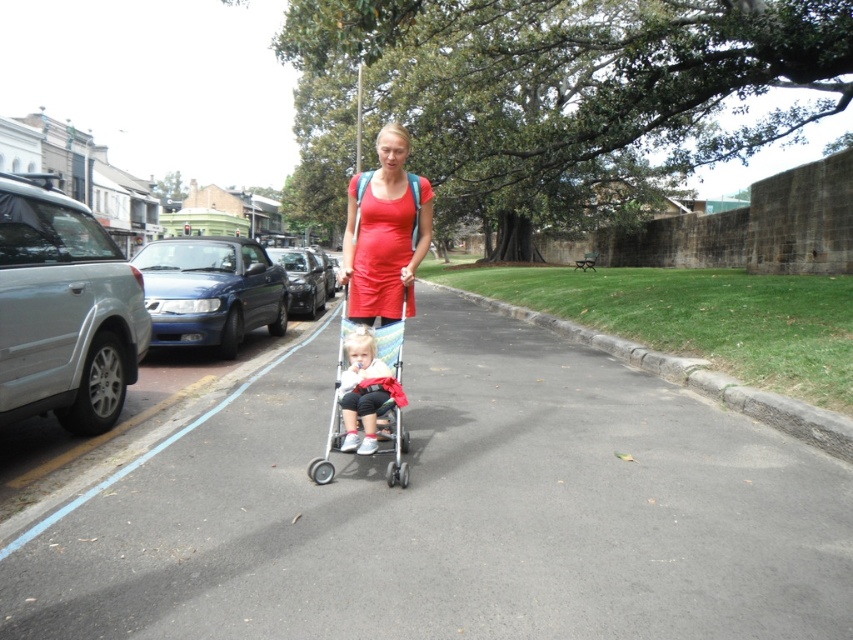
Which of these two, blue metallic car at left or shiny black car at center-left, stands taller?

With more height is shiny black car at center-left.

Is blue metallic car at left above shiny black car at center-left?

No.

Image resolution: width=853 pixels, height=640 pixels. What are the coordinates of `blue metallic car at left` in the screenshot? It's located at [x=212, y=291].

Which is above, plastic baby carriage at center or matte pink fabric stroller at center?

matte pink fabric stroller at center is higher up.

Which is more to the left, plastic baby carriage at center or matte pink fabric stroller at center?

plastic baby carriage at center

Identify the location of plastic baby carriage at center. This screenshot has width=853, height=640. [334, 410].

The width and height of the screenshot is (853, 640). I want to click on plastic baby carriage at center, so click(x=334, y=410).

Which is above, matte pink fabric stroller at center or shiny black car at center-left?

Positioned higher is shiny black car at center-left.

Is matte pink fabric stroller at center smaller than shiny black car at center-left?

Indeed, matte pink fabric stroller at center has a smaller size compared to shiny black car at center-left.

The height and width of the screenshot is (640, 853). I want to click on matte pink fabric stroller at center, so click(363, 390).